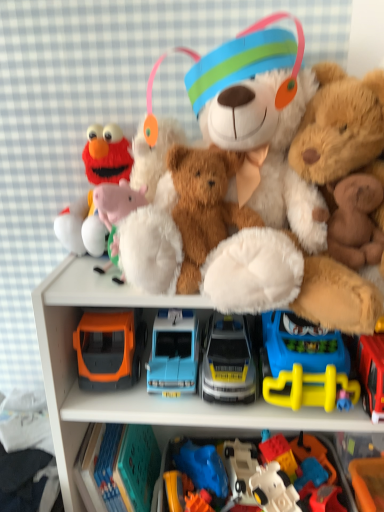
In the scene shown: What is the approximate width of velvet plush elmo at upper left, which is counted as the 11th toy, starting from the right?

A: It is 6.13 inches.

Identify the location of orange plastic toy at lower right, arranged as the 11th toy when viewed from the left. (368, 483).

What do you see at coordinates (368, 483) in the screenshot?
I see `orange plastic toy at lower right, the 1th toy in the right-to-left sequence` at bounding box center [368, 483].

What is the approximate height of white plastic shelf at center?

It is 34.10 inches.

This screenshot has width=384, height=512. Describe the element at coordinates (117, 467) in the screenshot. I see `orange plastic toy car at lower left, the second toy in the left-to-right sequence` at that location.

Describe the element at coordinates (280, 454) in the screenshot. This screenshot has height=512, width=384. I see `multicolored plastic blocks at lower center, acting as the 4th toy starting from the right` at that location.

Locate an element on the screen. The height and width of the screenshot is (512, 384). velvet plush elmo at upper left, which is counted as the 11th toy, starting from the right is located at coordinates (107, 155).

From the image's perspective, is yellow plastic toy at lower right, the 3th toy viewed from the right, below metallic silver car at center, the 7th toy viewed from the right?

Incorrect, from the image's perspective, yellow plastic toy at lower right, the 3th toy viewed from the right, is higher than metallic silver car at center, the 7th toy viewed from the right.

Is yellow plastic toy at lower right, which ranks as the 9th toy in left-to-right order, wider than metallic silver car at center, the 7th toy viewed from the right?

Correct, the width of yellow plastic toy at lower right, which ranks as the 9th toy in left-to-right order, exceeds that of metallic silver car at center, the 7th toy viewed from the right.

In the image, is yellow plastic toy at lower right, which ranks as the 9th toy in left-to-right order, positioned in front of or behind metallic silver car at center, which is the 5th toy from left to right?

yellow plastic toy at lower right, which ranks as the 9th toy in left-to-right order, is positioned closer to the viewer than metallic silver car at center, which is the 5th toy from left to right.

Is point (329, 402) less distant than point (213, 358)?

Yes, point (329, 402) is in front of point (213, 358).

Which object is positioned more to the left, yellow plastic toy at lower right, the 3th toy viewed from the right, or fuzzy brown teddy bear at center, positioned as the third teddy bear in right-to-left order?

fuzzy brown teddy bear at center, positioned as the third teddy bear in right-to-left order.

Is the surface of yellow plastic toy at lower right, which ranks as the 9th toy in left-to-right order, in direct contact with fuzzy brown teddy bear at center, positioned as the third teddy bear in right-to-left order?

No, yellow plastic toy at lower right, which ranks as the 9th toy in left-to-right order, is not beside fuzzy brown teddy bear at center, positioned as the third teddy bear in right-to-left order.

From a real-world perspective, is yellow plastic toy at lower right, the 3th toy viewed from the right, below fuzzy brown teddy bear at center, positioned as the third teddy bear in right-to-left order?

Indeed, from a real-world perspective, yellow plastic toy at lower right, the 3th toy viewed from the right, is positioned beneath fuzzy brown teddy bear at center, positioned as the third teddy bear in right-to-left order.

Is velvet plush elmo at upper left, which is counted as the 11th toy, starting from the right, aimed at metallic silver car at center, the 7th toy viewed from the right?

No, velvet plush elmo at upper left, which is counted as the 11th toy, starting from the right, is not turned towards metallic silver car at center, the 7th toy viewed from the right.

Can you tell me how much velvet plush elmo at upper left, the first toy viewed from the left, and metallic silver car at center, which is the 5th toy from left to right, differ in facing direction?

1.88 degrees separate the facing orientations of velvet plush elmo at upper left, the first toy viewed from the left, and metallic silver car at center, which is the 5th toy from left to right.

Is the depth of velvet plush elmo at upper left, the first toy viewed from the left, greater than that of metallic silver car at center, which is the 5th toy from left to right?

Yes, velvet plush elmo at upper left, the first toy viewed from the left, is behind metallic silver car at center, which is the 5th toy from left to right.

How distant is velvet plush elmo at upper left, the first toy viewed from the left, from metallic silver car at center, the 7th toy viewed from the right?

velvet plush elmo at upper left, the first toy viewed from the left, is 12.89 inches from metallic silver car at center, the 7th toy viewed from the right.

Is yellow plastic toy at lower right, the 3th toy viewed from the right, to the left or to the right of white plush toy at upper left, which is the 9th toy from right to left, in the image?

In the image, yellow plastic toy at lower right, the 3th toy viewed from the right, appears on the right side of white plush toy at upper left, which is the 9th toy from right to left.

Would you say yellow plastic toy at lower right, the 3th toy viewed from the right, is inside or outside white plush toy at upper left, which is the third toy in left-to-right order?

yellow plastic toy at lower right, the 3th toy viewed from the right, is spatially situated outside white plush toy at upper left, which is the third toy in left-to-right order.

Considering the sizes of yellow plastic toy at lower right, which ranks as the 9th toy in left-to-right order, and white plush toy at upper left, which is the third toy in left-to-right order, in the image, is yellow plastic toy at lower right, which ranks as the 9th toy in left-to-right order, bigger or smaller than white plush toy at upper left, which is the third toy in left-to-right order,?

In the image, yellow plastic toy at lower right, which ranks as the 9th toy in left-to-right order, appears to be larger than white plush toy at upper left, which is the third toy in left-to-right order.

Based on the photo, which object is wider, fuzzy brown teddy bear at center, acting as the first teddy bear starting from the left, or white plastic robot at lower center, which appears as the 7th toy when viewed from the left?

white plastic robot at lower center, which appears as the 7th toy when viewed from the left.

Is there a large distance between fuzzy brown teddy bear at center, positioned as the third teddy bear in right-to-left order, and white plastic robot at lower center, marked as the 5th toy in a right-to-left arrangement?

No, fuzzy brown teddy bear at center, positioned as the third teddy bear in right-to-left order, is not far away from white plastic robot at lower center, marked as the 5th toy in a right-to-left arrangement.

Is the depth of fuzzy brown teddy bear at center, positioned as the third teddy bear in right-to-left order, greater than that of white plastic robot at lower center, which appears as the 7th toy when viewed from the left?

No, the depth of fuzzy brown teddy bear at center, positioned as the third teddy bear in right-to-left order, is less than that of white plastic robot at lower center, which appears as the 7th toy when viewed from the left.

What are the coordinates of `the 3rd toy counting from the right of the fuzzy brown teddy bear at center, positioned as the third teddy bear in right-to-left order` in the screenshot? It's located at (317, 452).

From the picture: Is fluffy white teddy bear at upper center, which is the 2th teddy bear in left-to-right order, completely or partially outside of brown plush teddy bear at upper right?

Yes, fluffy white teddy bear at upper center, which is the 2th teddy bear in left-to-right order, is outside of brown plush teddy bear at upper right.

Considering the positions of point (248, 125) and point (328, 234), is point (248, 125) closer or farther from the camera than point (328, 234)?

Point (248, 125) is positioned closer to the camera compared to point (328, 234).

Which object is further away from the camera taking this photo, fluffy white teddy bear at upper center, arranged as the second teddy bear when viewed from the right, or brown plush teddy bear at upper right?

brown plush teddy bear at upper right is further from the camera.

Is fuzzy brown teddy bear at center, acting as the first teddy bear starting from the left, to the left or to the right of velvet plush elmo at upper left, which is counted as the 11th toy, starting from the right, in the image?

fuzzy brown teddy bear at center, acting as the first teddy bear starting from the left, is to the right of velvet plush elmo at upper left, which is counted as the 11th toy, starting from the right.

From the picture: From the image's perspective, is fuzzy brown teddy bear at center, acting as the first teddy bear starting from the left, on top of velvet plush elmo at upper left, which is counted as the 11th toy, starting from the right?

No.

Starting from the fuzzy brown teddy bear at center, positioned as the third teddy bear in right-to-left order, which toy is the 4th one behind? Please provide its 2D coordinates.

[(107, 155)]

Looking at this image, can you confirm if fuzzy brown teddy bear at center, positioned as the third teddy bear in right-to-left order, is smaller than velvet plush elmo at upper left, the first toy viewed from the left?

Correct, fuzzy brown teddy bear at center, positioned as the third teddy bear in right-to-left order, occupies less space than velvet plush elmo at upper left, the first toy viewed from the left.

Find the location of a particular element. the 1st toy behind when counting from the yellow plastic toy at lower right, the 3th toy viewed from the right is located at coordinates (228, 361).

From the image's perspective, count 2nd toys downward from the fuzzy brown teddy bear at center, acting as the first teddy bear starting from the left, and point to it. Please provide its 2D coordinates.

[(305, 364)]

Based on their spatial positions, is velvet plush elmo at upper left, the first toy viewed from the left, or multicolored plastic blocks at lower center, the eighth toy viewed from the left, further from blue plastic car at center, the eighth toy when ordered from right to left?

Among the two, multicolored plastic blocks at lower center, the eighth toy viewed from the left, is located further to blue plastic car at center, the eighth toy when ordered from right to left.

Looking at the image, which one is located further to white plush toy at upper left, which is the 9th toy from right to left, multicolored plastic blocks at lower center, the eighth toy viewed from the left, or yellow plastic toy at lower right, the 3th toy viewed from the right?

The object further to white plush toy at upper left, which is the 9th toy from right to left, is multicolored plastic blocks at lower center, the eighth toy viewed from the left.

Based on their spatial positions, is metallic silver car at center, the 7th toy viewed from the right, or white plastic robot at lower center, marked as the 5th toy in a right-to-left arrangement, further from multicolored plastic blocks at lower center, the eighth toy viewed from the left?

metallic silver car at center, the 7th toy viewed from the right, lies further to multicolored plastic blocks at lower center, the eighth toy viewed from the left, than the other object.

Which object lies further to the anchor point fluffy white teddy bear at upper center, arranged as the second teddy bear when viewed from the right, matte plastic toy car at center, marked as the 6th toy in a right-to-left arrangement, or white plastic robot at lower center, which appears as the 7th toy when viewed from the left?

matte plastic toy car at center, marked as the 6th toy in a right-to-left arrangement, is positioned further to the anchor fluffy white teddy bear at upper center, arranged as the second teddy bear when viewed from the right.

Based on their spatial positions, is white plastic robot at lower center, which appears as the 7th toy when viewed from the left, or fuzzy brown teddy bear at center, acting as the first teddy bear starting from the left, closer to fluffy white teddy bear at upper center, which is the 2th teddy bear in left-to-right order?

fuzzy brown teddy bear at center, acting as the first teddy bear starting from the left, lies closer to fluffy white teddy bear at upper center, which is the 2th teddy bear in left-to-right order, than the other object.

Looking at the image, which one is located further to brown plush teddy bear at upper right, white plush toy at upper left, which is the 9th toy from right to left, or fluffy white teddy bear at upper center, which is the 2th teddy bear in left-to-right order?

white plush toy at upper left, which is the 9th toy from right to left, is further to brown plush teddy bear at upper right.

From the image, which object appears to be farther from brown plush teddy bear at upper right, white plastic robot at lower center, marked as the 5th toy in a right-to-left arrangement, or metallic silver car at center, the 7th toy viewed from the right?

Among the two, white plastic robot at lower center, marked as the 5th toy in a right-to-left arrangement, is located further to brown plush teddy bear at upper right.

Which object lies nearer to the anchor point white plastic shelf at center, rubberized plastic toy at lower center, the 10th toy positioned from the left, or blue plastic car at center, the eighth toy when ordered from right to left?

The object closer to white plastic shelf at center is blue plastic car at center, the eighth toy when ordered from right to left.

The height and width of the screenshot is (512, 384). I want to click on teddy between fluffy white teddy bear at upper center, arranged as the second teddy bear when viewed from the right, and yellow plastic toy at lower right, which ranks as the 9th toy in left-to-right order, in the vertical direction, so click(x=356, y=221).

Locate an element on the screen. This screenshot has width=384, height=512. teddy between fluffy brown teddy bear at right, which is counted as the 1th teddy bear, starting from the right, and orange plastic toy at lower right, the 1th toy in the right-to-left sequence, in the up-down direction is located at coordinates (356, 221).

Find the location of `teddy between white plush toy at upper left, which is the third toy in left-to-right order, and fluffy brown teddy bear at right, which is counted as the 1th teddy bear, starting from the right, from left to right`. teddy between white plush toy at upper left, which is the third toy in left-to-right order, and fluffy brown teddy bear at right, which is counted as the 1th teddy bear, starting from the right, from left to right is located at coordinates (356, 221).

Identify the location of teddy between fluffy brown teddy bear at right, which ranks as the third teddy bear in left-to-right order, and yellow plastic toy at lower right, which ranks as the 9th toy in left-to-right order, vertically. This screenshot has width=384, height=512. (356, 221).